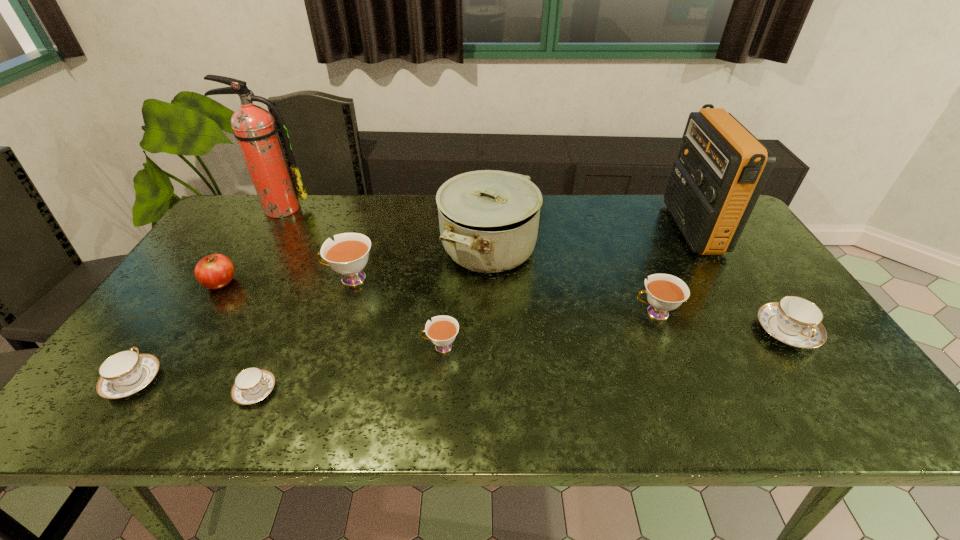
Locate an element on the screen. fire extinguisher is located at coordinates (254, 128).

At what (x,y) coordinates should I click in order to perform the action: click on radio receiver. Please return your answer as a coordinate pair (x, y). This screenshot has width=960, height=540. Looking at the image, I should click on (721, 170).

The width and height of the screenshot is (960, 540). I want to click on the third tallest object, so click(x=488, y=219).

Find the location of a particular element. This screenshot has height=540, width=960. the farthest white teacup is located at coordinates (348, 255).

What are the coordinates of `the tallest teacup` in the screenshot? It's located at (348, 255).

This screenshot has height=540, width=960. I want to click on apple, so click(x=215, y=271).

You are a GUI agent. You are given a task and a screenshot of the screen. Output one action in this format:
    pyautogui.click(x=<x>, y=<y>)
    Task: Click on the eighth object from left to right
    The width and height of the screenshot is (960, 540).
    Given the screenshot: What is the action you would take?
    pyautogui.click(x=665, y=292)

Image resolution: width=960 pixels, height=540 pixels. Identify the location of the second teacup from right to left. (665, 292).

Locate an element on the screen. This screenshot has height=540, width=960. the rightmost blue teacup is located at coordinates (795, 321).

The image size is (960, 540). What are the coordinates of `the biggest blue teacup` in the screenshot? It's located at (795, 321).